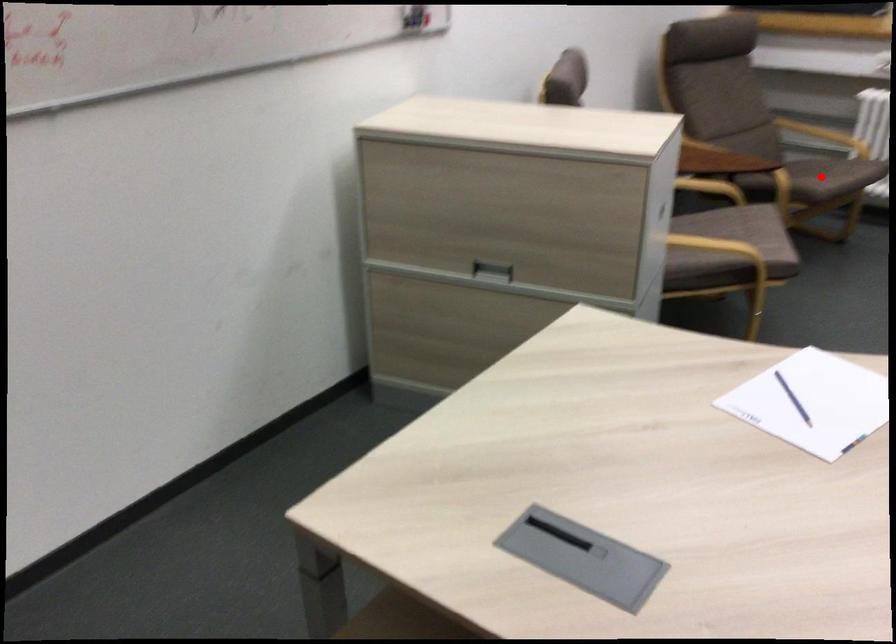
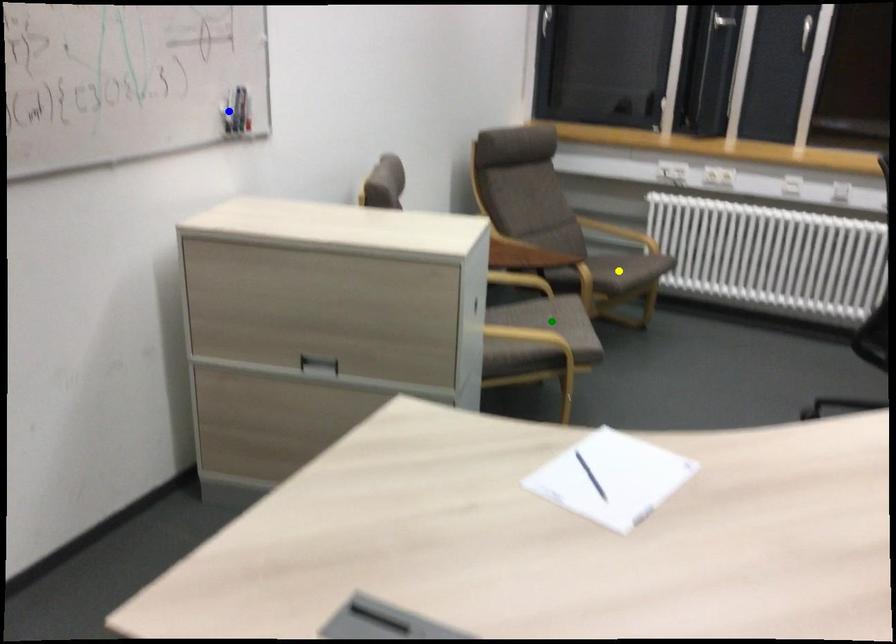
Question: I am providing you with two images of the same scene from different viewpoints. A red point is marked on the first image. You are given multiple points on the second image. Can you choose the point in image 2 that corresponds to the point in image 1?

Choices:
 (A) blue point
 (B) yellow point
 (C) green point

Answer: (B)